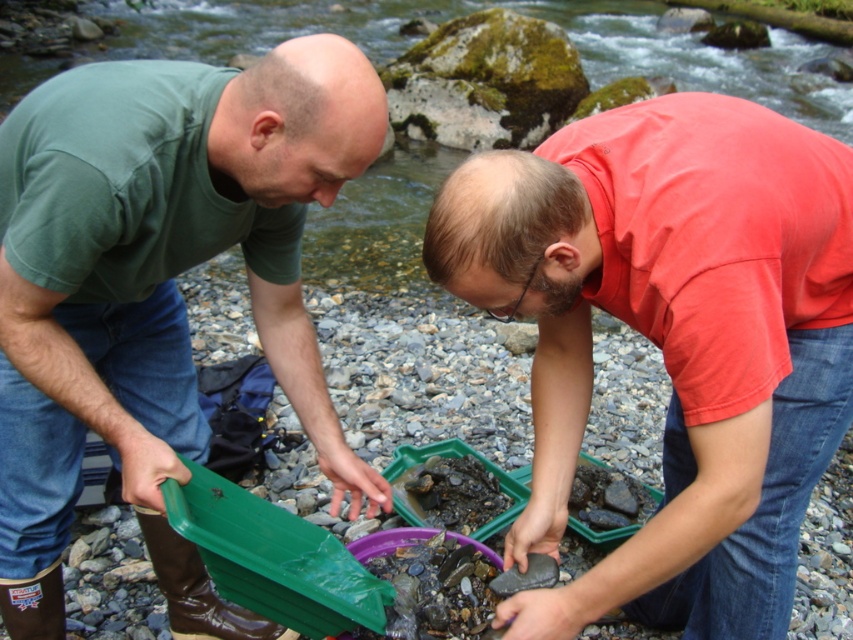
Is matte red shirt at center closer to the viewer compared to green matte tray at left?

Yes, it is.

Does matte red shirt at center appear under green matte tray at left?

Yes, matte red shirt at center is below green matte tray at left.

Is point (566, 204) positioned before point (198, 588)?

Yes.

Identify the location of matte red shirt at center. The width and height of the screenshot is (853, 640). (672, 339).